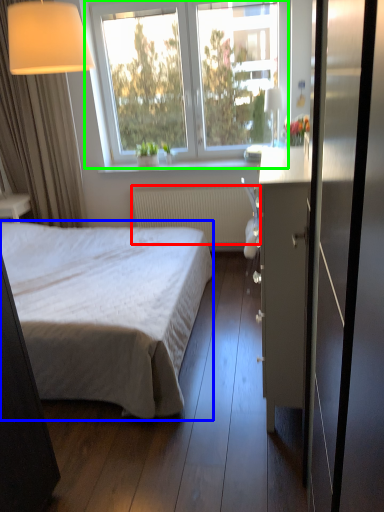
Question: Which object is the closest to the radiator (highlighted by a red box)? Choose among these: bed (highlighted by a blue box) or window (highlighted by a green box).

Choices:
 (A) bed
 (B) window

Answer: (B)